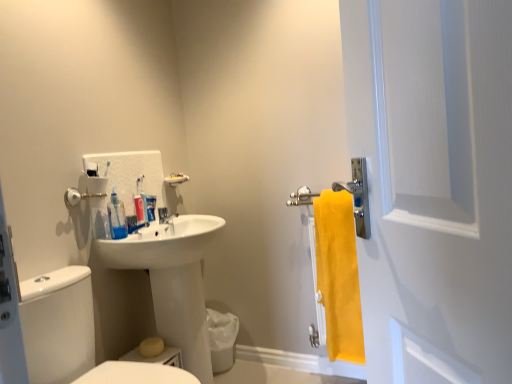
Question: Would you say white matte toothpaste at center is to the left or to the right of satin nickel faucet at sink left in the picture?

Choices:
 (A) right
 (B) left

Answer: (B)

Question: Considering the positions of point (145, 208) and point (167, 221), is point (145, 208) closer or farther from the camera than point (167, 221)?

Choices:
 (A) closer
 (B) farther

Answer: (A)

Question: Considering the real-world distances, which object is farthest from the translucent plastic toothpaste tube at upper center?

Choices:
 (A) transparent plastic mouthwash at center
 (B) yellow fabric towel at right
 (C) white matte screen door at right
 (D) white glossy toilet at lower left
 (E) satin nickel faucet at sink left

Answer: (C)

Question: Which is nearer to the transparent plastic mouthwash at center?

Choices:
 (A) white glossy toilet at lower left
 (B) yellow fabric towel at right
 (C) translucent plastic toothpaste tube at upper center
 (D) white matte toothpaste at center
 (E) white glossy sink at center

Answer: (C)